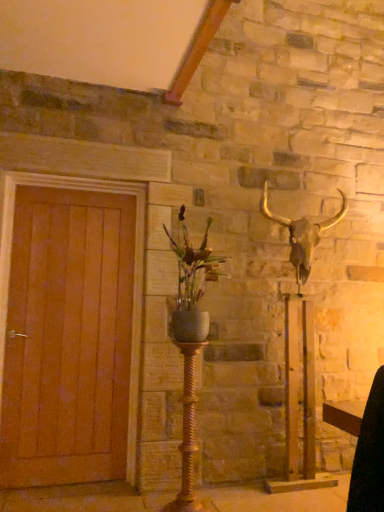
Measure the distance between gold twisted metal candle holder at center and camera.

7.87 feet.

Image resolution: width=384 pixels, height=512 pixels. Find the location of `wooden door at left`. wooden door at left is located at coordinates [133, 277].

Where is `gold twisted metal candle holder at center`? gold twisted metal candle holder at center is located at coordinates (188, 433).

Relative to wooden door at left, is gold twisted metal candle holder at center in front or behind?

gold twisted metal candle holder at center is positioned closer to the viewer than wooden door at left.

What's the angular difference between gold twisted metal candle holder at center and wooden door at left's facing directions?

gold twisted metal candle holder at center and wooden door at left are facing 1.39 degrees away from each other.

From the picture: Is gold twisted metal candle holder at center positioned far away from wooden door at left?

No, gold twisted metal candle holder at center is not far away from wooden door at left.

Does point (203, 511) appear closer or farther from the camera than point (4, 249)?

Clearly, point (203, 511) is closer to the camera than point (4, 249).

Does wooden door at left turn towards matte gray vase at center?

No, wooden door at left is not aimed at matte gray vase at center.

From the picture: Is wooden door at left located outside matte gray vase at center?

wooden door at left lies outside matte gray vase at center's area.

Is wooden door at left positioned far away from matte gray vase at center?

That's not correct — wooden door at left is a little close to matte gray vase at center.

Is point (8, 239) closer to camera compared to point (190, 261)?

No, it is not.

Could you measure the distance between gold twisted metal candle holder at center and metallic gold bull skull at upper right?

A distance of 32.55 inches exists between gold twisted metal candle holder at center and metallic gold bull skull at upper right.

Based on the photo, is gold twisted metal candle holder at center not inside metallic gold bull skull at upper right?

gold twisted metal candle holder at center lies outside metallic gold bull skull at upper right's area.

Who is shorter, gold twisted metal candle holder at center or metallic gold bull skull at upper right?

gold twisted metal candle holder at center.

Is gold twisted metal candle holder at center far away from metallic gold bull skull at upper right?

gold twisted metal candle holder at center is actually quite close to metallic gold bull skull at upper right.

Between wooden door at left and metallic gold bull skull at upper right, which one has less height?

With less height is wooden door at left.

Consider the image. Could you tell me if wooden door at left is turned towards metallic gold bull skull at upper right?

No, wooden door at left does not turn towards metallic gold bull skull at upper right.

Identify the location of sculpture below the wooden door at left (from the image's perspective). The width and height of the screenshot is (384, 512). (297, 351).

From the picture: From the image's perspective, between wooden door at left and metallic gold bull skull at upper right, who is located below?

metallic gold bull skull at upper right.

From a real-world perspective, is metallic gold bull skull at upper right below gold twisted metal candle holder at center?

No, from a real-world perspective, metallic gold bull skull at upper right is not below gold twisted metal candle holder at center.

Is metallic gold bull skull at upper right facing away from gold twisted metal candle holder at center?

metallic gold bull skull at upper right is not turned away from gold twisted metal candle holder at center.

Considering the sizes of metallic gold bull skull at upper right and gold twisted metal candle holder at center in the image, is metallic gold bull skull at upper right wider or thinner than gold twisted metal candle holder at center?

In the image, metallic gold bull skull at upper right appears to be wider than gold twisted metal candle holder at center.

Which of these two, metallic gold bull skull at upper right or gold twisted metal candle holder at center, stands shorter?

With less height is gold twisted metal candle holder at center.

The height and width of the screenshot is (512, 384). I want to click on sculpture behind the matte gray vase at center, so click(x=297, y=351).

Is metallic gold bull skull at upper right completely or partially inside matte gray vase at center?

Actually, metallic gold bull skull at upper right is outside matte gray vase at center.

Considering the sizes of objects matte gray vase at center and metallic gold bull skull at upper right in the image provided, who is bigger, matte gray vase at center or metallic gold bull skull at upper right?

Bigger between the two is metallic gold bull skull at upper right.

Considering the sizes of objects matte gray vase at center and metallic gold bull skull at upper right in the image provided, who is thinner, matte gray vase at center or metallic gold bull skull at upper right?

metallic gold bull skull at upper right is thinner.

Are gold twisted metal candle holder at center and matte gray vase at center beside each other?

gold twisted metal candle holder at center and matte gray vase at center are clearly separated.

At what (x,y) coordinates should I click in order to perform the action: click on candle holder that is on the left side of matte gray vase at center. Please return your answer as a coordinate pair (x, y). This screenshot has height=512, width=384. Looking at the image, I should click on (188, 433).

Does point (181, 477) appear closer or farther from the camera than point (176, 329)?

Point (181, 477) is farther from the camera than point (176, 329).

Considering the relative sizes of gold twisted metal candle holder at center and matte gray vase at center in the image provided, is gold twisted metal candle holder at center shorter than matte gray vase at center?

No.

Where is `candle holder on the right of wooden door at left`? The width and height of the screenshot is (384, 512). candle holder on the right of wooden door at left is located at coordinates (188, 433).

At what (x,y) coordinates should I click in order to perform the action: click on door on the left of the matte gray vase at center. Please return your answer as a coordinate pair (x, y). Looking at the image, I should click on (133, 277).

Based on their spatial positions, is matte gray vase at center or metallic gold bull skull at upper right further from wooden door at left?

Among the two, metallic gold bull skull at upper right is located further to wooden door at left.

Estimate the real-world distances between objects in this image. Which object is further from matte gray vase at center, gold twisted metal candle holder at center or wooden door at left?

The object further to matte gray vase at center is wooden door at left.

Consider the image. From the image, which object appears to be farther from matte gray vase at center, gold twisted metal candle holder at center or metallic gold bull skull at upper right?

metallic gold bull skull at upper right is positioned further to the anchor matte gray vase at center.

Estimate the real-world distances between objects in this image. Which object is closer to gold twisted metal candle holder at center, metallic gold bull skull at upper right or wooden door at left?

wooden door at left.

When comparing their distances from gold twisted metal candle holder at center, does metallic gold bull skull at upper right or matte gray vase at center seem further?

Based on the image, metallic gold bull skull at upper right appears to be further to gold twisted metal candle holder at center.

Looking at the image, which one is located further to wooden door at left, metallic gold bull skull at upper right or gold twisted metal candle holder at center?

metallic gold bull skull at upper right lies further to wooden door at left than the other object.

Which object lies nearer to the anchor point gold twisted metal candle holder at center, wooden door at left or metallic gold bull skull at upper right?

Based on the image, wooden door at left appears to be nearer to gold twisted metal candle holder at center.

Which object lies further to the anchor point metallic gold bull skull at upper right, matte gray vase at center or wooden door at left?

The object further to metallic gold bull skull at upper right is wooden door at left.

You are a GUI agent. You are given a task and a screenshot of the screen. Output one action in this format:
    pyautogui.click(x=<x>, y=<y>)
    Task: Click on the door between matte gray vase at center and gold twisted metal candle holder at center in the up-down direction
    The height and width of the screenshot is (512, 384).
    Given the screenshot: What is the action you would take?
    pyautogui.click(x=133, y=277)

This screenshot has height=512, width=384. Find the location of `sculpture between matte gray vase at center and gold twisted metal candle holder at center from top to bottom`. sculpture between matte gray vase at center and gold twisted metal candle holder at center from top to bottom is located at coordinates (297, 351).

This screenshot has height=512, width=384. What are the coordinates of `candle holder between wooden door at left and metallic gold bull skull at upper right from left to right` in the screenshot? It's located at (188, 433).

Locate an element on the screen. houseplant between wooden door at left and metallic gold bull skull at upper right from left to right is located at coordinates (192, 285).